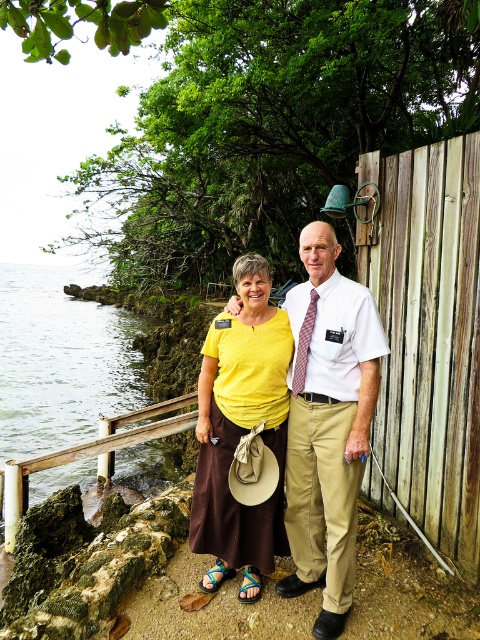
In the scene shown: Between weathered wood fence at right and clear water at lower left, which one appears on the left side from the viewer's perspective?

clear water at lower left

Does weathered wood fence at right have a lesser height compared to clear water at lower left?

Indeed, weathered wood fence at right has a lesser height compared to clear water at lower left.

Who is more distant from viewer, (429,442) or (12,401)?

The point (12,401) is more distant.

Find the location of a particular element. This screenshot has width=480, height=640. weathered wood fence at right is located at coordinates (429, 333).

From the picture: Is the position of weathered wood fence at right less distant than that of yellow matte shirt at center?

No, it is not.

Which is below, weathered wood fence at right or yellow matte shirt at center?

yellow matte shirt at center is below.

This screenshot has width=480, height=640. I want to click on weathered wood fence at right, so click(429, 333).

Does yellow cotton shirt at center have a lesser height compared to clear water at lower left?

Yes.

Does yellow cotton shirt at center appear on the left side of clear water at lower left?

In fact, yellow cotton shirt at center is to the right of clear water at lower left.

This screenshot has height=640, width=480. Identify the location of yellow cotton shirt at center. (327, 422).